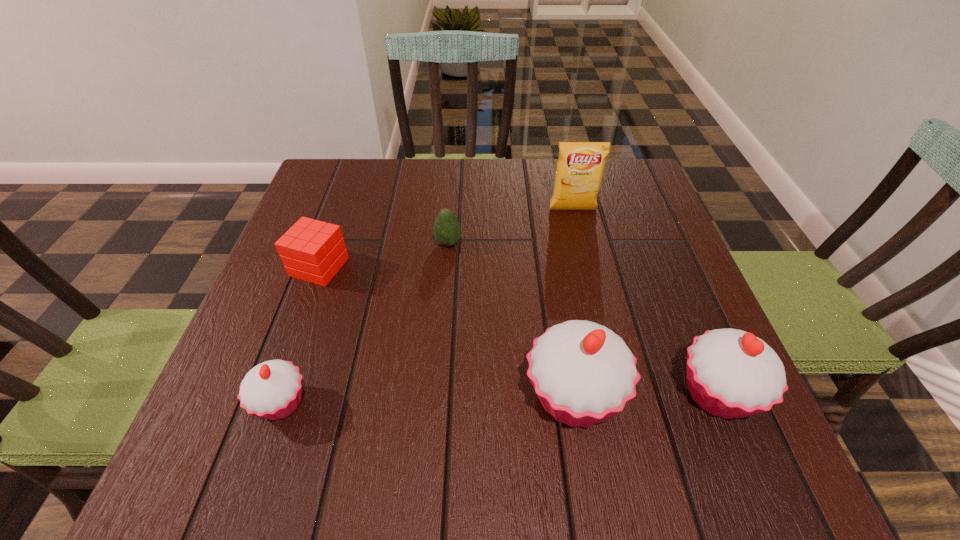
Where is `the leftmost cupcake`? The image size is (960, 540). the leftmost cupcake is located at coordinates 272,390.

The height and width of the screenshot is (540, 960). Identify the location of the second cupcake from left to right. (583, 373).

I want to click on the third tallest object, so click(x=731, y=373).

At what (x,y) coordinates should I click in order to perform the action: click on the rightmost object. Please return your answer as a coordinate pair (x, y). The height and width of the screenshot is (540, 960). Looking at the image, I should click on (731, 373).

Locate an element on the screen. This screenshot has height=540, width=960. crisp (potato chip) is located at coordinates (580, 167).

At what (x,y) coordinates should I click in order to perform the action: click on avocado. Please return your answer as a coordinate pair (x, y). Looking at the image, I should click on (447, 231).

Locate an element on the screen. cube is located at coordinates (311, 250).

I want to click on free space located 0.270m on the right of the shortest cupcake, so click(x=473, y=403).

I want to click on free region located 0.330m on the back of the second cupcake from left to right, so click(x=547, y=235).

Locate an element on the screen. The image size is (960, 540). free space located on the back of the second shortest cupcake is located at coordinates (680, 302).